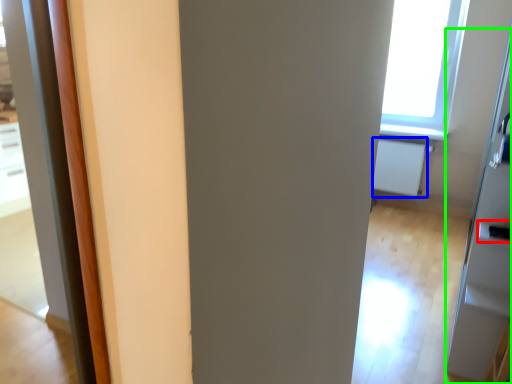
Question: Estimate the real-world distances between objects in this image. Which object is closer to door handle (highlighted by a red box), radiator (highlighted by a blue box) or screen door (highlighted by a green box)?

Choices:
 (A) radiator
 (B) screen door

Answer: (B)